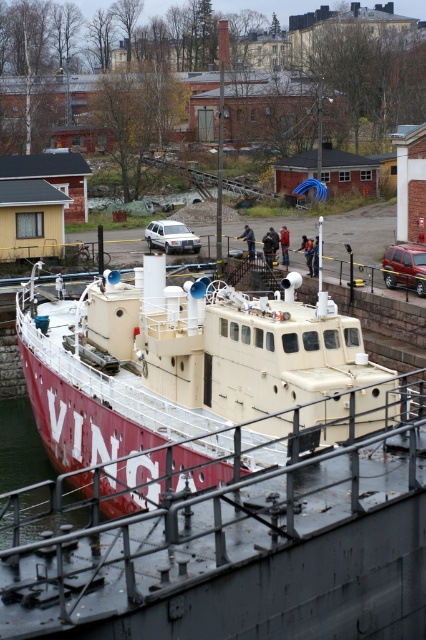
Question: Which point is farther to the camera?

Choices:
 (A) (299, 404)
 (B) (376, 433)

Answer: (A)

Question: Is metallic gray rail at lower center further to camera compared to red matte boat at center?

Choices:
 (A) no
 (B) yes

Answer: (A)

Question: Which point is farther to the camera?

Choices:
 (A) metallic gray rail at lower center
 (B) red matte boat at center

Answer: (B)

Question: Can you confirm if metallic gray rail at lower center is positioned to the right of red matte boat at center?

Choices:
 (A) no
 (B) yes

Answer: (B)

Question: Is metallic gray rail at lower center wider than red matte boat at center?

Choices:
 (A) no
 (B) yes

Answer: (B)